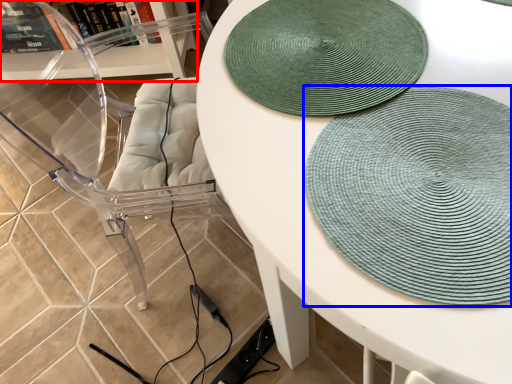
Question: Which of the following is the closest to the observer, shelf (highlighted by a red box) or mat (highlighted by a blue box)?

Choices:
 (A) shelf
 (B) mat

Answer: (B)